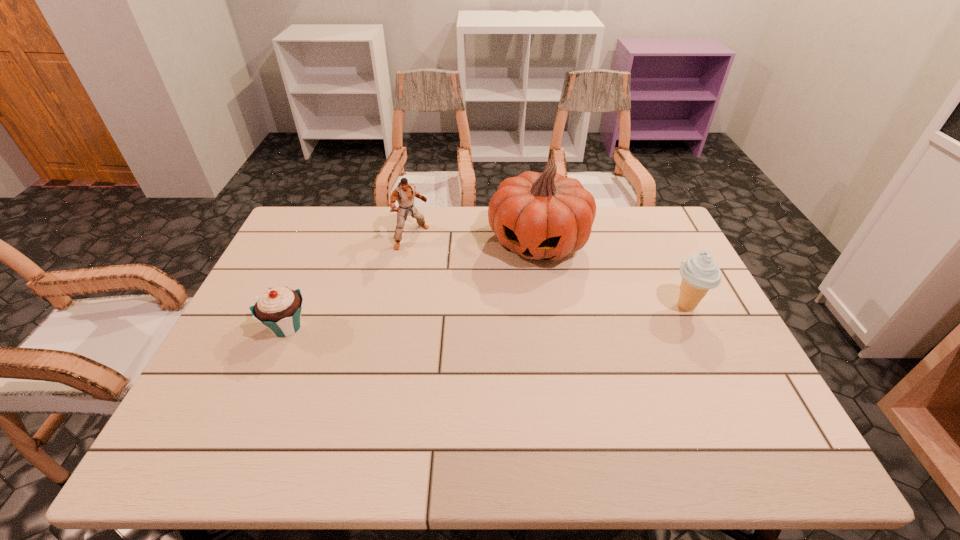
Locate an element on the screen. free space at the left edge is located at coordinates (235, 359).

Where is `free space at the far left corner of the desktop`? This screenshot has width=960, height=540. free space at the far left corner of the desktop is located at coordinates (308, 221).

You are a GUI agent. You are given a task and a screenshot of the screen. Output one action in this format:
    pyautogui.click(x=<x>, y=<y>)
    Task: Click on the free region at the near left corner
    This screenshot has width=960, height=540.
    Given the screenshot: What is the action you would take?
    pyautogui.click(x=249, y=416)

I want to click on vacant position at the far right corner of the desktop, so click(633, 223).

The image size is (960, 540). Find the location of `free space at the near right corner of the desktop`. free space at the near right corner of the desktop is located at coordinates (756, 399).

Where is `blank region between the rightmost object and the third object from left to right`? blank region between the rightmost object and the third object from left to right is located at coordinates (612, 274).

The height and width of the screenshot is (540, 960). In order to click on free space between the cupcake and the tallest object in this screenshot , I will do `click(413, 285)`.

What are the coordinates of `free space between the icecream and the tallest object` in the screenshot? It's located at (612, 274).

Image resolution: width=960 pixels, height=540 pixels. I want to click on unoccupied area between the cupcake and the rightmost object, so click(487, 316).

This screenshot has width=960, height=540. I want to click on vacant area that lies between the pumpkin and the cupcake, so click(413, 285).